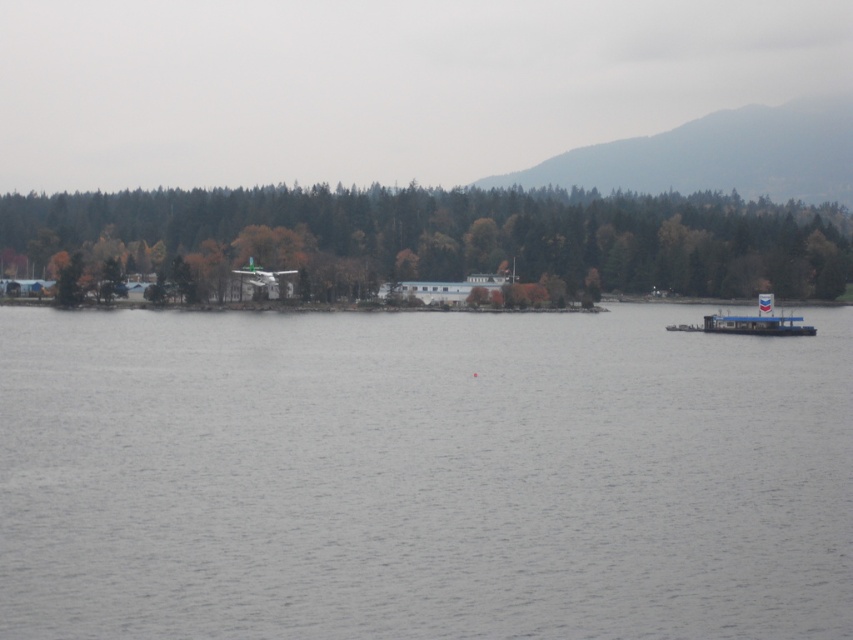
Who is lower down, green matte tree at center or blue plastic boat at right?

Positioned lower is blue plastic boat at right.

This screenshot has width=853, height=640. In order to click on green matte tree at center in this screenshot , I will do tap(457, 236).

Who is more distant from viewer, (606, 278) or (706, 324)?

Point (606, 278)

Where is `green matte tree at center`? Image resolution: width=853 pixels, height=640 pixels. green matte tree at center is located at coordinates (457, 236).

Can you confirm if gray water at center is taller than blue plastic boat at right?

Yes.

Does point (683, 362) lie behind point (775, 320)?

No, it is in front of (775, 320).

At what (x,y) coordinates should I click in order to perform the action: click on gray water at center. Please return your answer as a coordinate pair (x, y). The width and height of the screenshot is (853, 640). Looking at the image, I should click on (421, 476).

What do you see at coordinates (421, 476) in the screenshot? I see `gray water at center` at bounding box center [421, 476].

Between point (27, 333) and point (434, 193), which one is positioned in front?

Point (27, 333) is more forward.

Does point (463, 403) lie behind point (482, 228)?

That is False.

Identify the location of gray water at center. The image size is (853, 640). (421, 476).